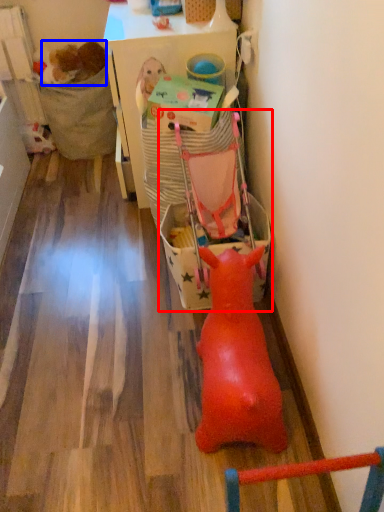
Question: Which of the following is the closest to the observer, baby carriage (highlighted by a red box) or animal (highlighted by a blue box)?

Choices:
 (A) baby carriage
 (B) animal

Answer: (A)